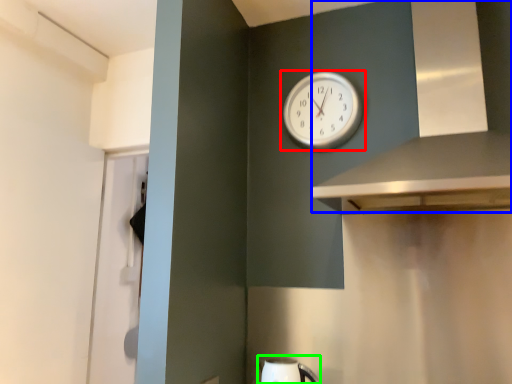
Question: Considering the real-world distances, which object is closest to wall clock (highlighted by a red box)? vent (highlighted by a blue box) or sink (highlighted by a green box).

Choices:
 (A) vent
 (B) sink

Answer: (A)